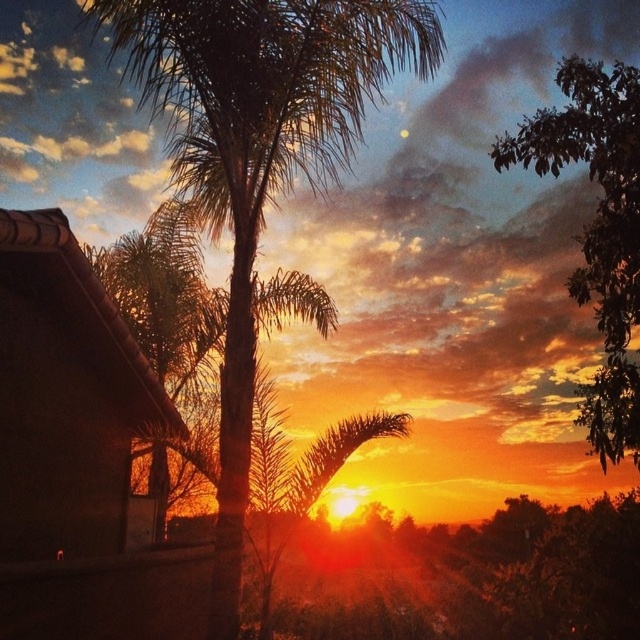
Question: Does green leafy palm tree at center appear on the right side of green leafy tree at upper right?

Choices:
 (A) yes
 (B) no

Answer: (B)

Question: From the image, what is the correct spatial relationship of green leafy palm tree at center in relation to green leafy tree at upper right?

Choices:
 (A) right
 (B) left

Answer: (B)

Question: Is green leafy palm tree at center above green leafy tree at upper right?

Choices:
 (A) no
 (B) yes

Answer: (A)

Question: Which point is closer to the camera?

Choices:
 (A) green leafy palm tree at center
 (B) green leafy tree at upper right

Answer: (B)

Question: Which object appears farthest from the camera in this image?

Choices:
 (A) green leafy palm tree at center
 (B) green leafy tree at upper right

Answer: (A)